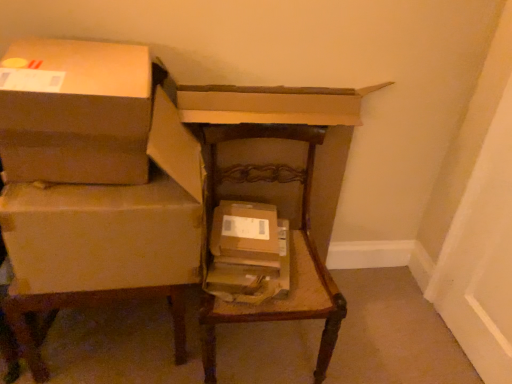
The height and width of the screenshot is (384, 512). Identify the location of free space above brown cardboard box at center, which ranks as the 1th box in right-to-left order (from a real-world perspective). (244, 228).